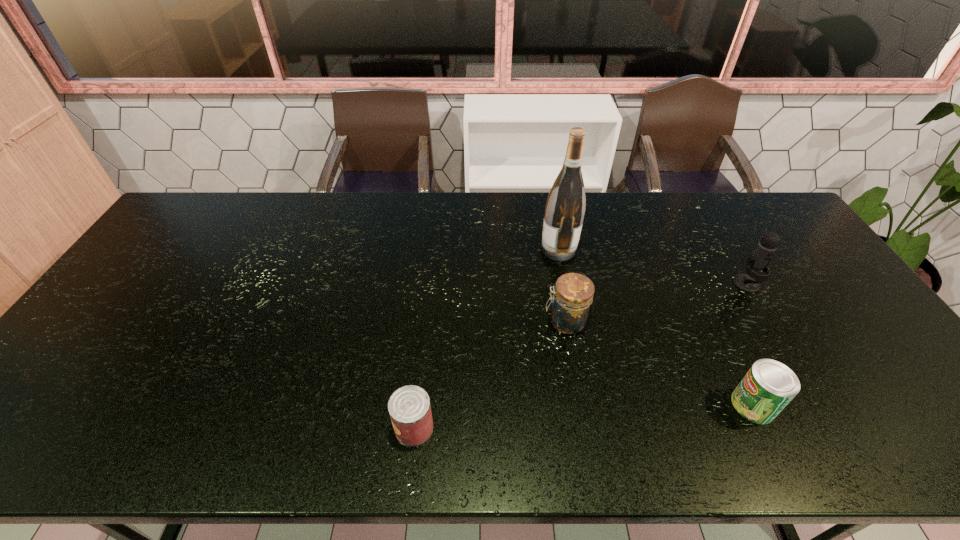
At what (x,y) coordinates should I click in order to perform the action: click on free space located on the label of the tallest object. Please return your answer as a coordinate pair (x, y). The image size is (960, 540). Looking at the image, I should click on pos(491,249).

This screenshot has width=960, height=540. I want to click on vacant space located on the front of the rightmost object, so pos(774,329).

You are a GUI agent. You are given a task and a screenshot of the screen. Output one action in this format:
    pyautogui.click(x=<x>, y=<y>)
    Task: Click on the free space located 0.280m on the lid of the jar
    
    Given the screenshot: What is the action you would take?
    pyautogui.click(x=442, y=322)

I want to click on blank space located on the lid of the jar, so click(442, 322).

Locate an element on the screen. The image size is (960, 540). vacant position located 0.070m on the lid of the jar is located at coordinates (518, 322).

Where is `free space located 0.330m on the back of the fourth object from left to right`? The height and width of the screenshot is (540, 960). free space located 0.330m on the back of the fourth object from left to right is located at coordinates (697, 288).

Locate an element on the screen. Image resolution: width=960 pixels, height=540 pixels. vacant area located on the back of the leftmost object is located at coordinates (419, 383).

You are a GUI agent. You are given a task and a screenshot of the screen. Output one action in this format:
    pyautogui.click(x=<x>, y=<y>)
    Task: Click on the vacant region at the far edge of the desktop
    
    Given the screenshot: What is the action you would take?
    pyautogui.click(x=607, y=230)

Image resolution: width=960 pixels, height=540 pixels. In order to click on free space at the near edge of the desktop in this screenshot , I will do [x=854, y=430].

Find the location of a particular element. The image size is (960, 540). free space at the left edge of the desktop is located at coordinates (92, 351).